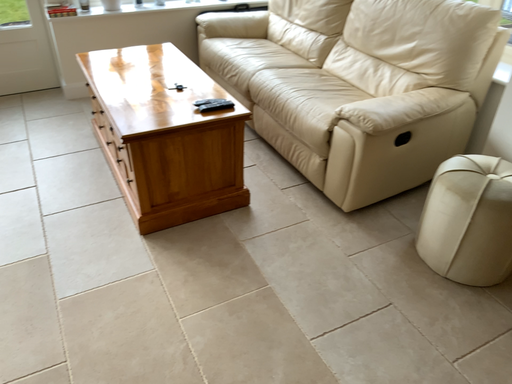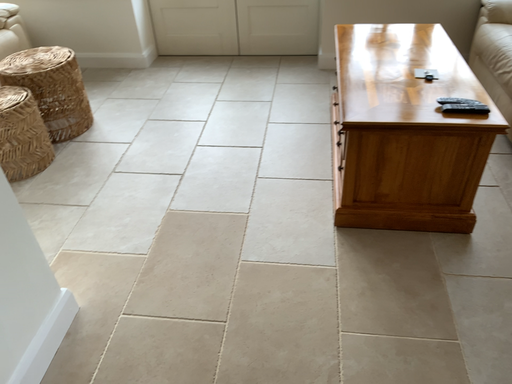
Question: Which way did the camera rotate in the video?

Choices:
 (A) rotated left
 (B) rotated right

Answer: (A)